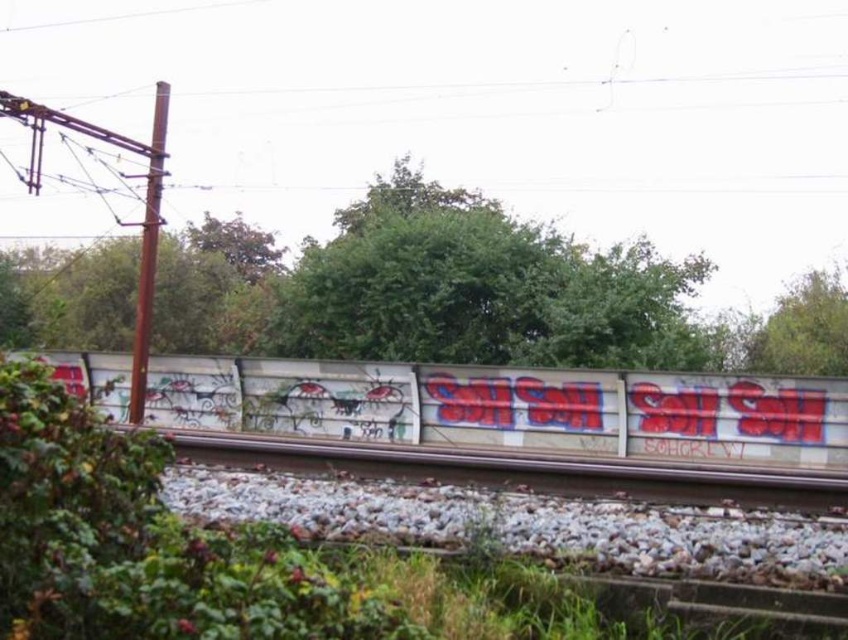
Looking at this image, you are standing on the railway tracks and see the white graffiti wall at center and the green leafy tree at upper right. Which object is closer to your left side?

The white graffiti wall at center is positioned on the left side of green leafy tree at upper right, so it is closer to your left side.

From the picture: You are a photographer trying to capture the entire white concrete train track at center in your shot without cropping. You notice a green leafy tree at center in the way. Based on the scene, can the tree be moved aside to allow the track to be fully visible?

The green leafy tree at center is wider than the white concrete train track at center. Since the tree is wider, it would block more of the track, making it difficult to capture the entire track without moving the tree.

You are a maintenance worker needing to inspect the white graffiti wall at center and the white concrete train track at center. The safety protocol requires you to stay at least 40 inches away from the tracks. Can you safely perform the inspection without violating the safety distance?

The white graffiti wall at center is 35.59 inches away from the white concrete train track at center. Since the required safety distance is 40 inches, the current distance is insufficient. You must move further away from the tracks to comply with safety protocols.